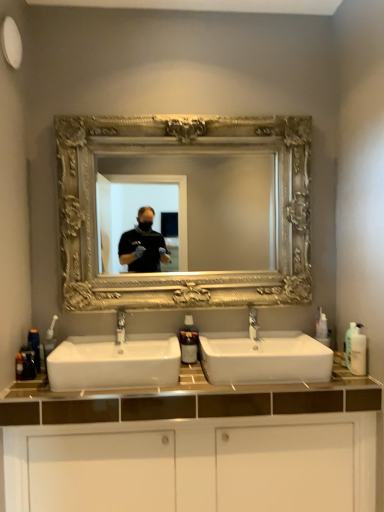
Image resolution: width=384 pixels, height=512 pixels. What are the coordinates of `vacant area in front of translucent plastic bottle at lower left, placed as the 2th toiletry when sorted from left to right` in the screenshot? It's located at (24, 390).